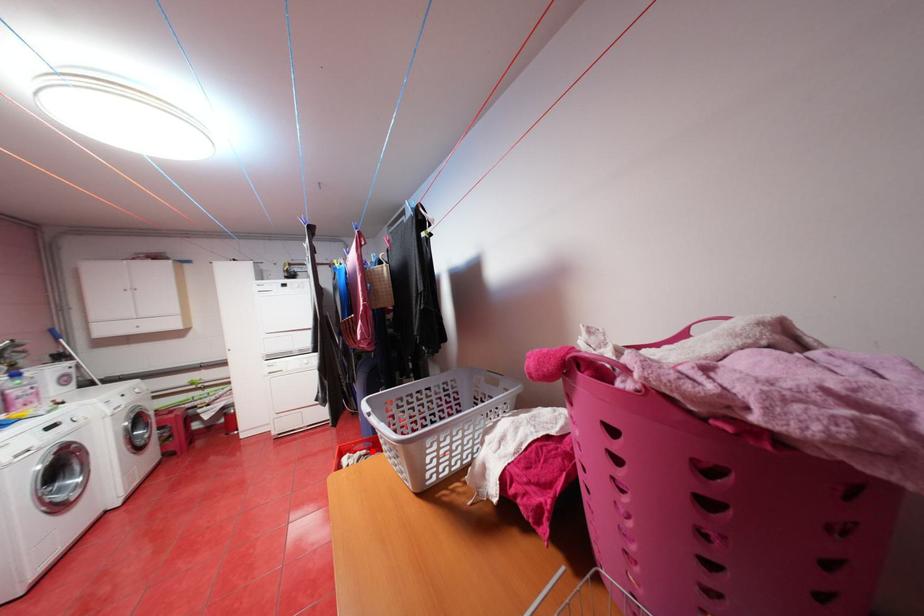
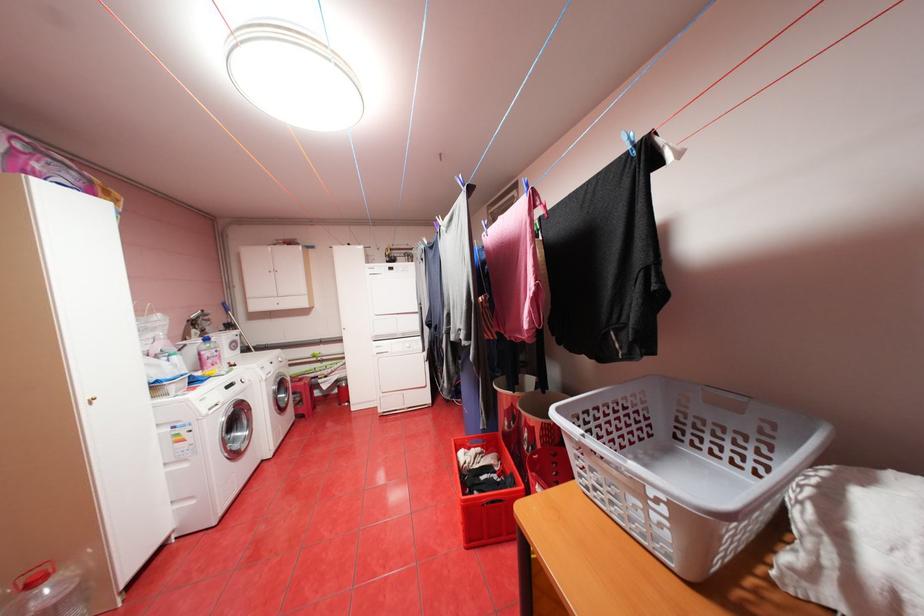
The point at the highlighted location is marked in the first image. Where is the corresponding point in the second image?

(488, 448)